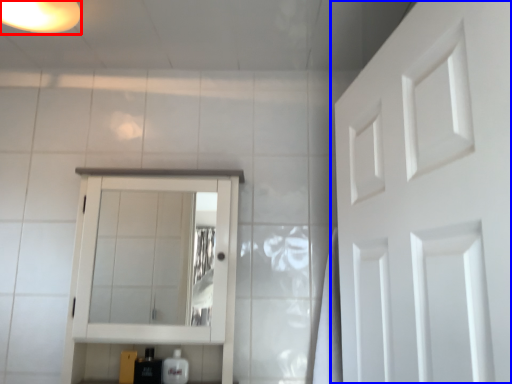
Question: Which of the following is the closest to the observer, light fixture (highlighted by a red box) or door (highlighted by a blue box)?

Choices:
 (A) light fixture
 (B) door

Answer: (B)